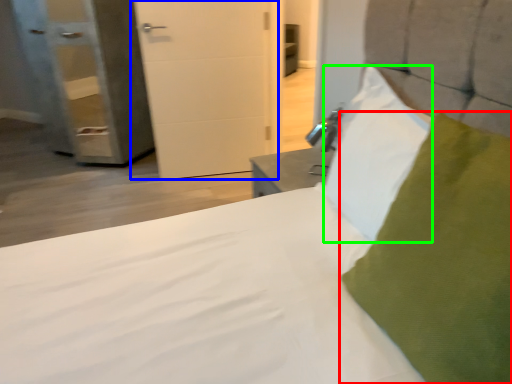
Question: Which is farther away from pillow (highlighted by a red box)? door (highlighted by a blue box) or pillow (highlighted by a green box)?

Choices:
 (A) door
 (B) pillow

Answer: (A)